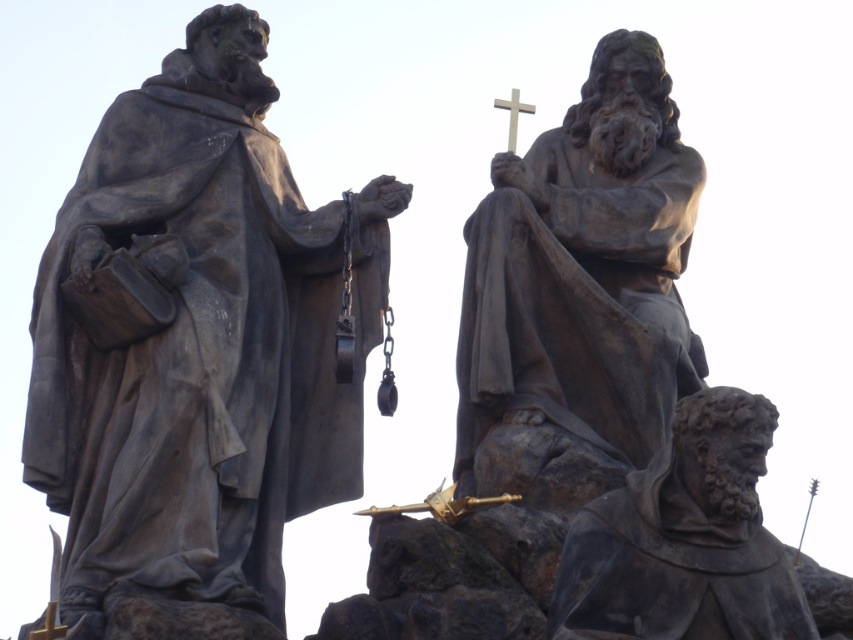
Who is more forward, (248,134) or (428,499)?

Point (428,499) is more forward.

From the picture: Which is below, matte gray statue at left or gold metallic crucifix at center?

gold metallic crucifix at center is below.

Where is `matte gray statue at left`? The image size is (853, 640). matte gray statue at left is located at coordinates (196, 337).

Locate an element on the screen. The width and height of the screenshot is (853, 640). matte gray statue at left is located at coordinates (196, 337).

Can you confirm if dark gray stone statue at lower right is positioned below gold metallic crucifix at center?

Actually, dark gray stone statue at lower right is above gold metallic crucifix at center.

How distant is dark gray stone statue at lower right from gold metallic crucifix at center?

11.35 meters

Who is more distant from viewer, (780, 576) or (465, 502)?

Positioned behind is point (465, 502).

What are the coordinates of `dark gray stone statue at lower right` in the screenshot? It's located at (683, 540).

Can you confirm if bronze statue of jesus holding cross at center is positioned to the right of dark gray stone statue at lower right?

Incorrect, bronze statue of jesus holding cross at center is not on the right side of dark gray stone statue at lower right.

Does bronze statue of jesus holding cross at center have a lesser height compared to dark gray stone statue at lower right?

Incorrect, bronze statue of jesus holding cross at center's height does not fall short of dark gray stone statue at lower right's.

Is point (463, 388) positioned in front of point (735, 458)?

No, (463, 388) is further to viewer.

You are a GUI agent. You are given a task and a screenshot of the screen. Output one action in this format:
    pyautogui.click(x=<x>, y=<y>)
    Task: Click on the bronze statue of jesus holding cross at center
    
    Given the screenshot: What is the action you would take?
    pyautogui.click(x=584, y=269)